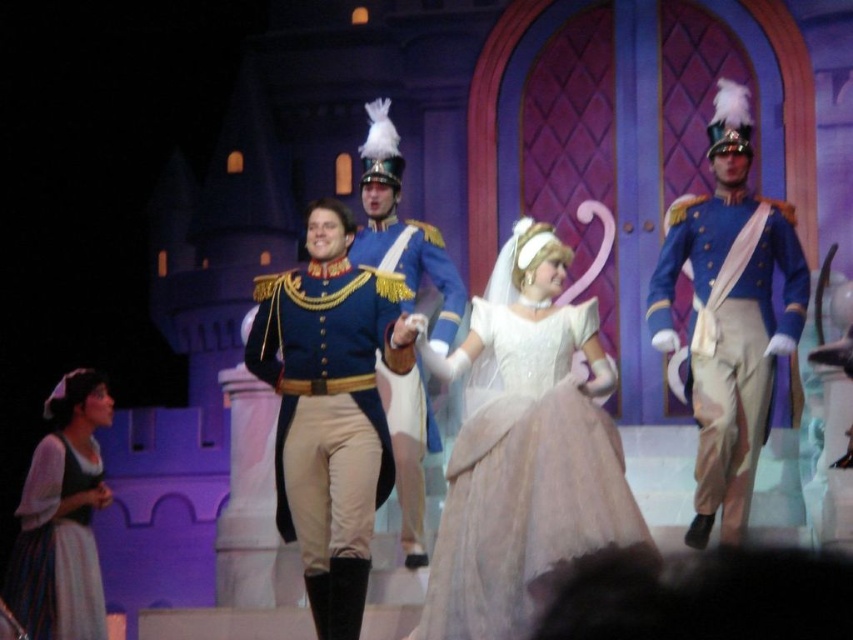
You are a stagehand standing at the camera position. You need to place a spotlight at point [718,435]. The spotlight has a maximum range of 60 meters. Will the spotlight reach the point?

The point [718,435] is 59.65 meters from the camera, so yes, the spotlight can reach it since it is within the 60 meters range.

Based on the scene description, which object is positioned lower in the image? The white satin dress at center or the blue satin uniform at center?

The white satin dress at center is positioned below the blue satin uniform at center, so it is lower in the image.